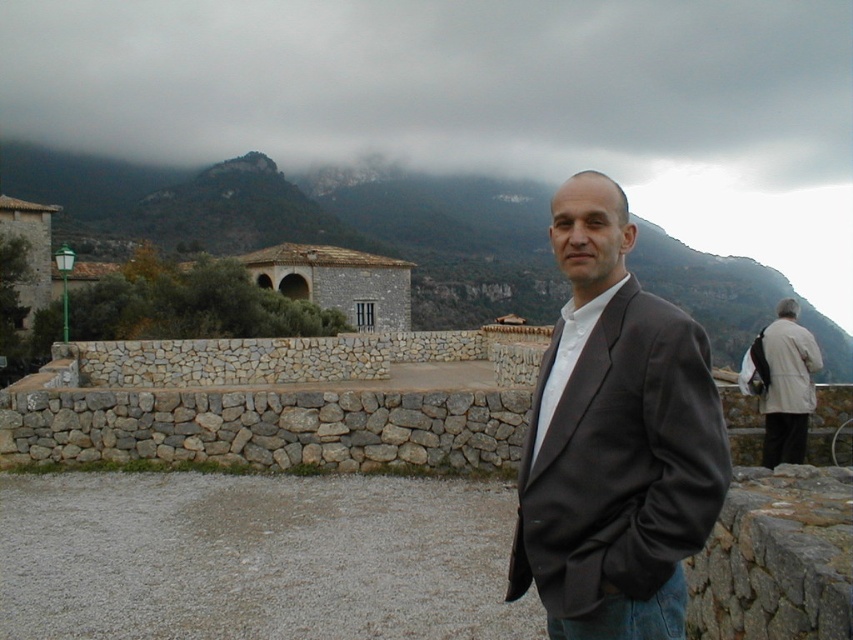
Where is the rocky mountain at upper center located in the image?

The rocky mountain at upper center is located at point coordinates of (311, 221).